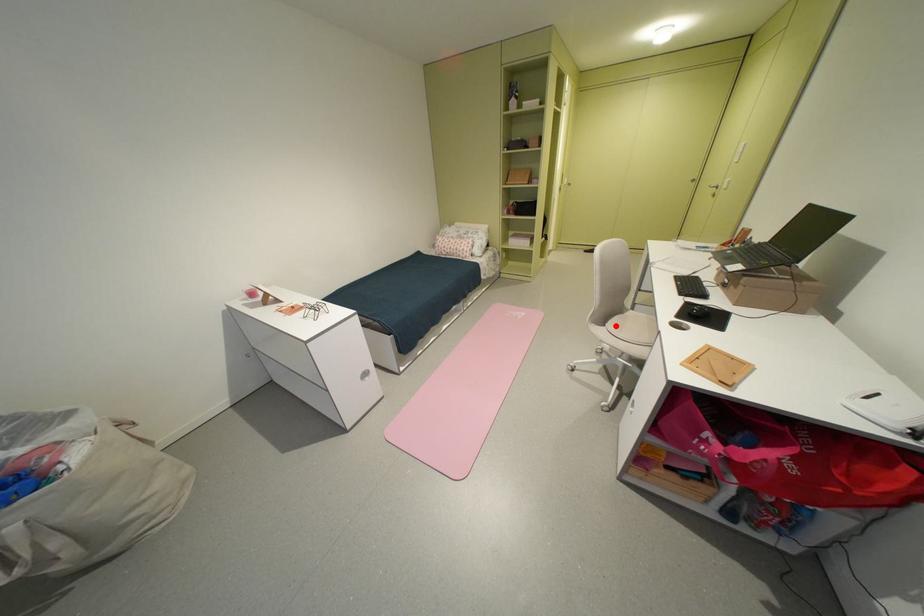
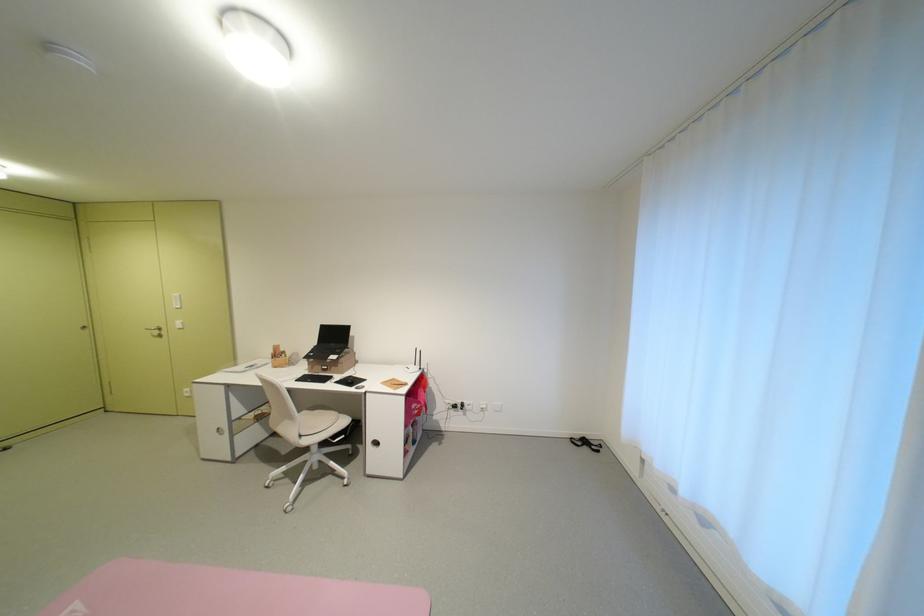
Locate, in the second image, the point that corresponds to the highlighted location in the first image.

(311, 436)